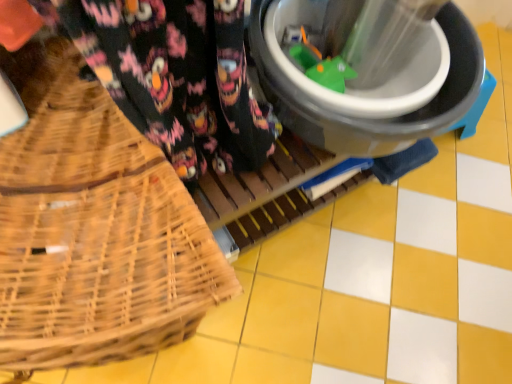
Question: From their relative heights in the image, would you say woven wood picnic basket at left is taller or shorter than black plastic bucket at center?

Choices:
 (A) tall
 (B) short

Answer: (A)

Question: Is woven wood picnic basket at left to the left or to the right of black plastic bucket at center in the image?

Choices:
 (A) right
 (B) left

Answer: (B)

Question: Relative to black plastic bucket at center, is woven wood picnic basket at left in front or behind?

Choices:
 (A) front
 (B) behind

Answer: (A)

Question: Considering the positions of black plastic bucket at center and woven wood picnic basket at left in the image, is black plastic bucket at center wider or thinner than woven wood picnic basket at left?

Choices:
 (A) wide
 (B) thin

Answer: (B)

Question: Looking at the image, does black plastic bucket at center seem bigger or smaller compared to woven wood picnic basket at left?

Choices:
 (A) small
 (B) big

Answer: (A)

Question: Would you say black plastic bucket at center is to the left or to the right of woven wood picnic basket at left in the picture?

Choices:
 (A) left
 (B) right

Answer: (B)

Question: From a real-world perspective, is black plastic bucket at center above or below woven wood picnic basket at left?

Choices:
 (A) above
 (B) below

Answer: (A)